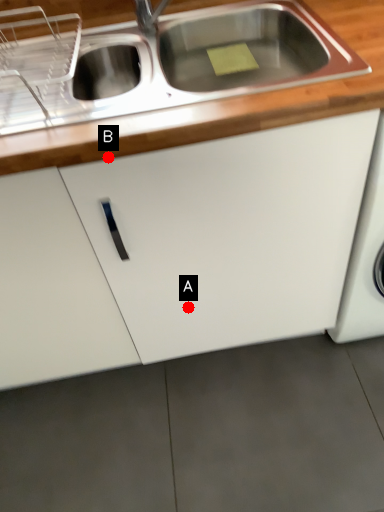
Question: Two points are circled on the image, labeled by A and B beside each circle. Which of the following is the farthest from the observer?

Choices:
 (A) A is further
 (B) B is further

Answer: (A)